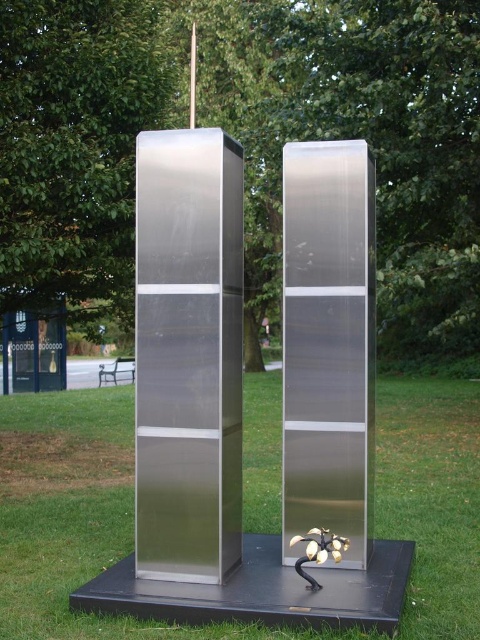
Who is shorter, green grass at center or satin silver sculpture at center?

Standing shorter between the two is green grass at center.

Can you confirm if green grass at center is positioned to the right of satin silver sculpture at center?

No, green grass at center is not to the right of satin silver sculpture at center.

Locate an element on the screen. Image resolution: width=480 pixels, height=640 pixels. green grass at center is located at coordinates (78, 518).

Which is behind, point (408, 525) or point (136, 433)?

Positioned behind is point (408, 525).

Does green grass at center lie in front of satin metallic column at center?

Yes.

Does point (25, 536) lie in front of point (222, 314)?

That is False.

Identify the location of green grass at center. (78, 518).

Can you confirm if satin metallic column at center is thinner than satin silver sculpture at center?

No, satin metallic column at center is not thinner than satin silver sculpture at center.

Can you confirm if satin metallic column at center is smaller than satin silver sculpture at center?

Actually, satin metallic column at center might be larger than satin silver sculpture at center.

The height and width of the screenshot is (640, 480). In order to click on satin metallic column at center in this screenshot , I will do `click(188, 355)`.